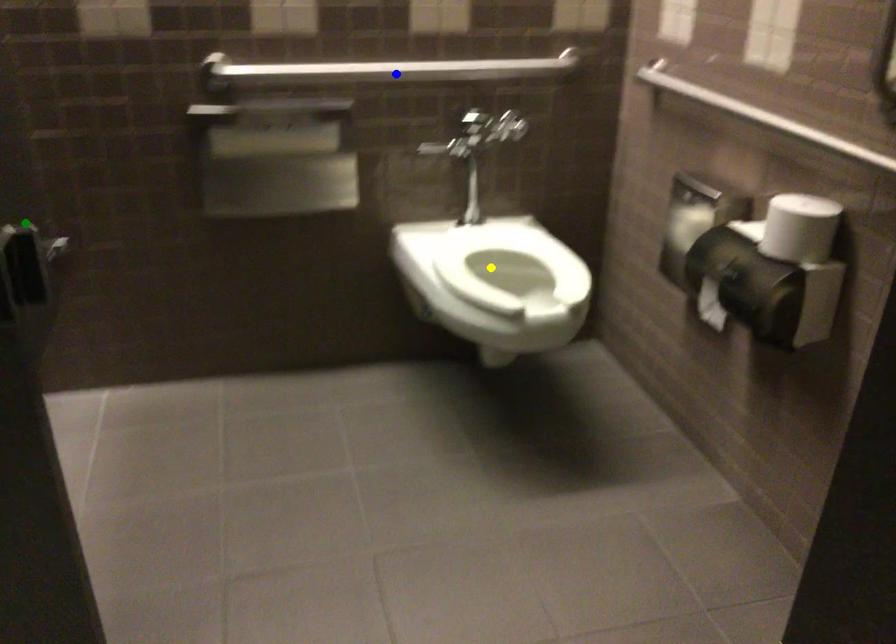
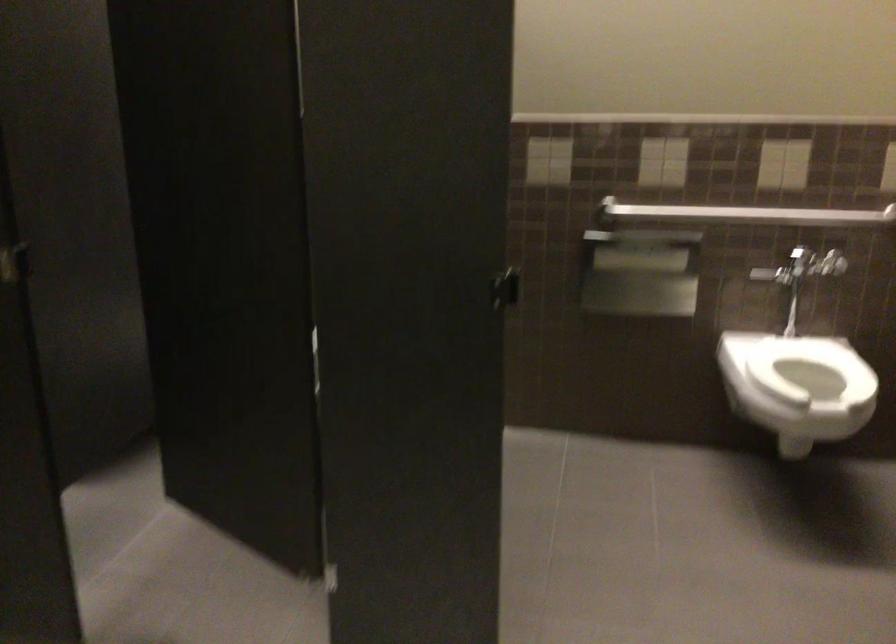
I am providing you with two images of the same scene from different viewpoints. Three points are marked in image1. Which point corresponds to a part or object that is occluded in image2?In image1, three points are marked. Which of them correspond to a part or object that is occluded in image2?Among the three points shown in image1, which one corresponds to a part or object that is no longer visible due to occlusion in image2?

green point cannot be seen in image2.